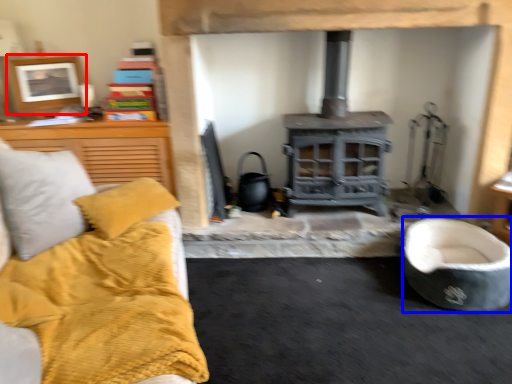
Question: Among these objects, which one is nearest to the camera, picture frame (highlighted by a red box) or rocking chair (highlighted by a blue box)?

Choices:
 (A) picture frame
 (B) rocking chair

Answer: (B)